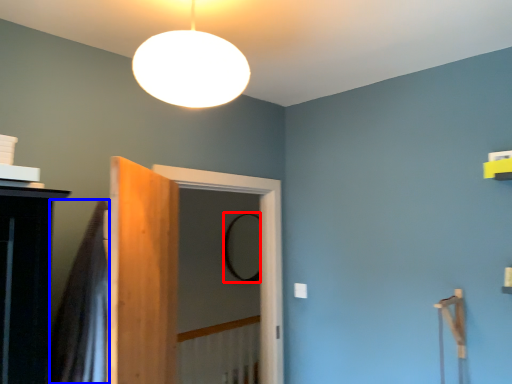
Question: Which of the following is the closest to the observer, mirror (highlighted by a red box) or shower curtain (highlighted by a blue box)?

Choices:
 (A) mirror
 (B) shower curtain

Answer: (B)